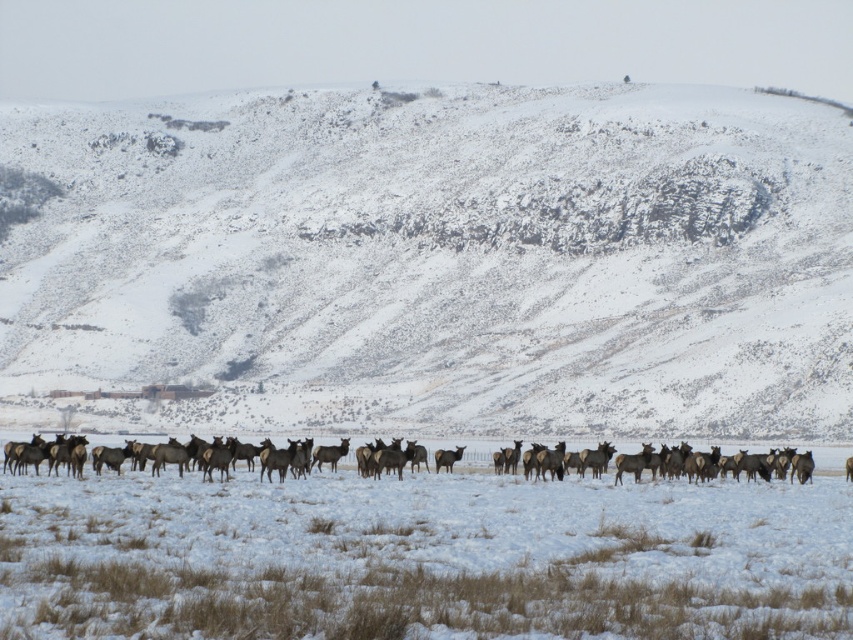
You are an explorer navigating a snowy field and need to reach a hidden cave entrance marked by point [440,465]. There is an obstacle at point [329,284]. Will you encounter the obstacle before reaching the cave entrance?

Yes, you will encounter the obstacle at point [329,284] before reaching the cave entrance at point [440,465] because the obstacle is closer to the camera than the cave entrance.

You are an elk in the brown fur herd at center. You want to reach the snowy rock at center to rest. Which direction should you move relative to your current position?

The snowy rock at center is closer to you than the brown fur herd at center, so you should move forward to reach it.